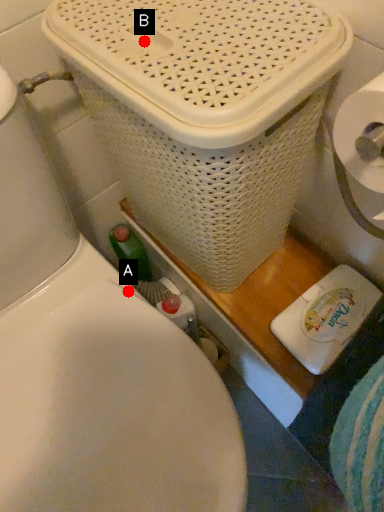
Question: Two points are circled on the image, labeled by A and B beside each circle. Among these points, which one is nearest to the camera?

Choices:
 (A) A is closer
 (B) B is closer

Answer: (B)